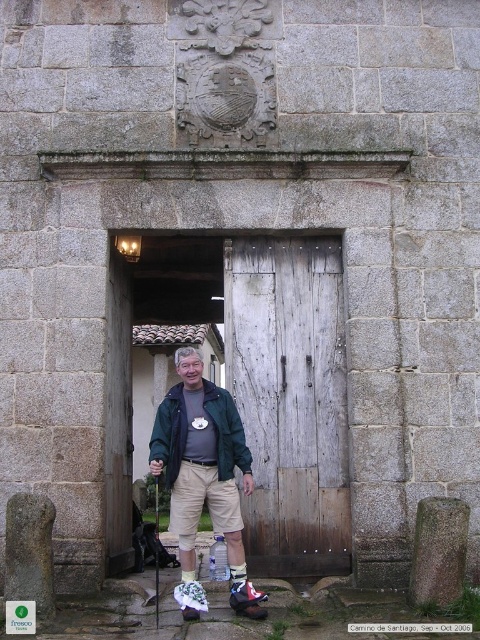
Which of these two, weathered wood door at center or green fabric jacket at center, stands shorter?

With less height is green fabric jacket at center.

Can you confirm if weathered wood door at center is wider than green fabric jacket at center?

No.

At what (x,y) coordinates should I click in order to perform the action: click on weathered wood door at center. Please return your answer as a coordinate pair (x, y). The width and height of the screenshot is (480, 640). Looking at the image, I should click on (289, 400).

Where is `weathered wood door at center`? The width and height of the screenshot is (480, 640). weathered wood door at center is located at coordinates (289, 400).